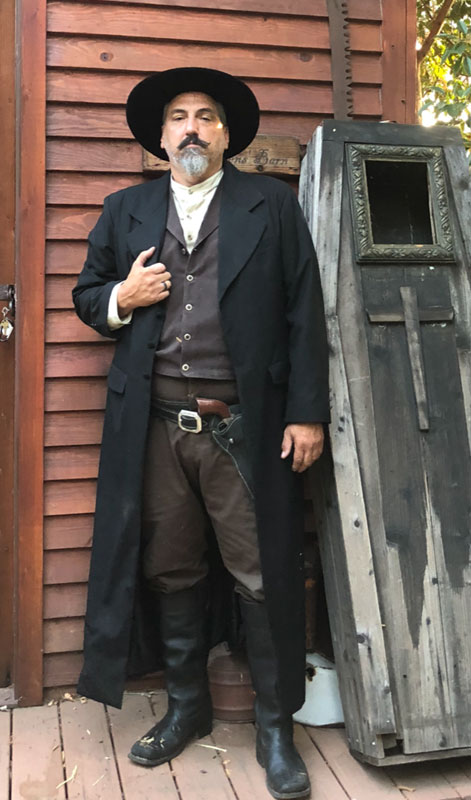
Locate an element on the screen. Image resolution: width=471 pixels, height=800 pixels. crate is located at coordinates (411, 677).